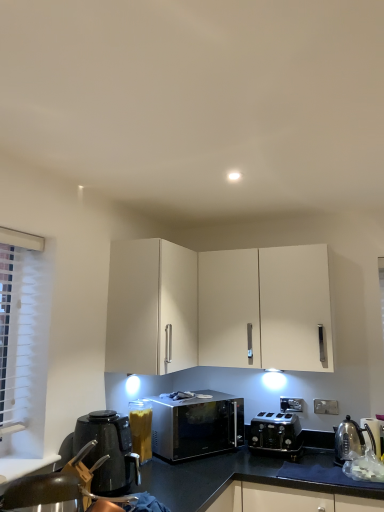
Question: From their relative heights in the image, would you say metallic silver swivel chair at lower left is taller or shorter than black plastic kettle at lower left?

Choices:
 (A) short
 (B) tall

Answer: (A)

Question: From a real-world perspective, is metallic silver swivel chair at lower left physically located above or below black plastic kettle at lower left?

Choices:
 (A) below
 (B) above

Answer: (A)

Question: Considering the real-world distances, which object is closest to the white plastic electric outlet at lower right?

Choices:
 (A) white matte cabinet at upper center
 (B) metallic silver swivel chair at lower left
 (C) sleek metallic microwave at center
 (D) polished stainless steel kettle at lower right, which is the 2th appliance in left-to-right order
 (E) black plastic kettle at lower left

Answer: (D)

Question: Which object is positioned closest to the white matte cabinet at upper center?

Choices:
 (A) black metallic toaster at lower center
 (B) metallic silver swivel chair at lower left
 (C) black plastic kettle at lower left
 (D) polished stainless steel kettle at lower right, arranged as the 2th appliance when viewed from the right
 (E) metallic silver kettle at right, which appears as the 3th appliance when viewed from the left

Answer: (C)